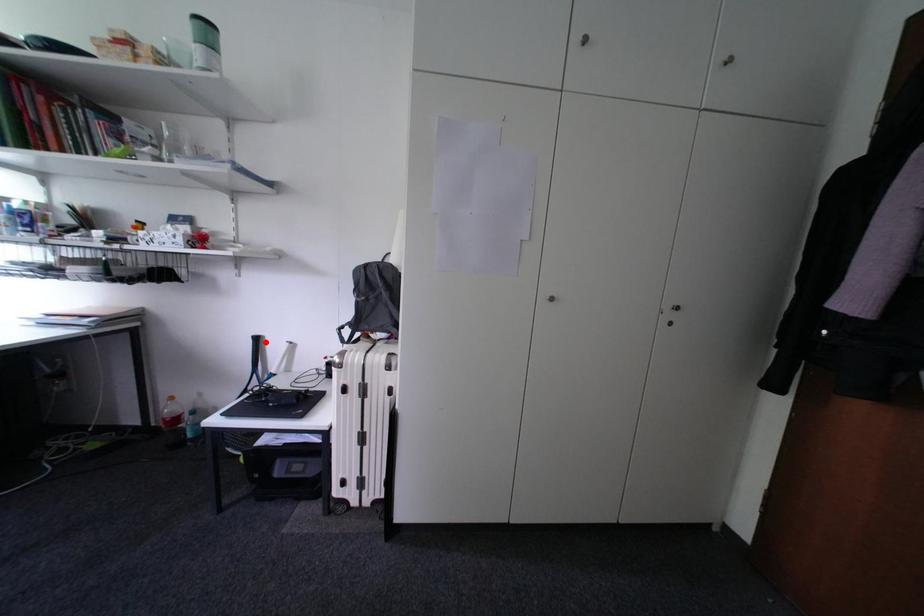
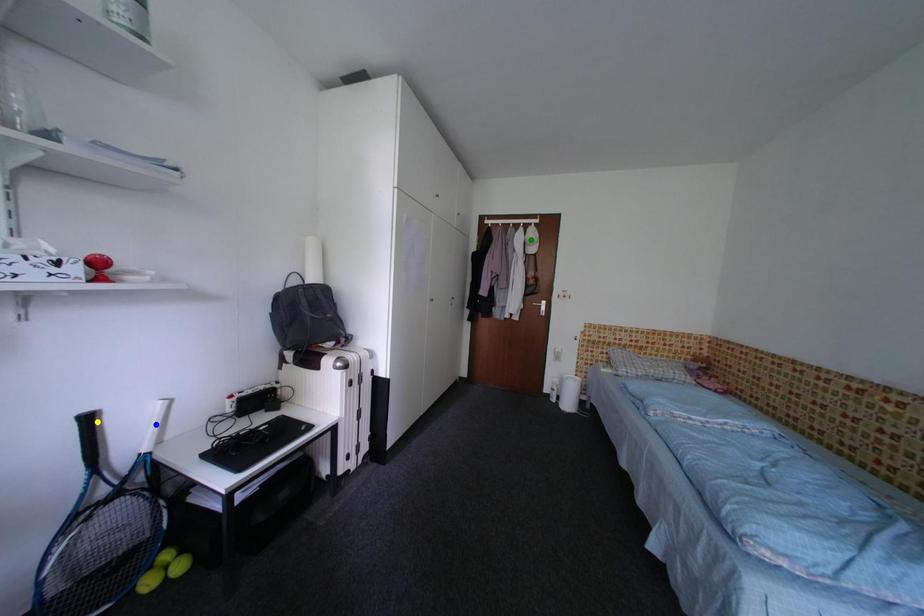
Question: I am providing you with two images of the same scene from different viewpoints. A red point is marked on the first image. You are given multiple points on the second image. Which point in image 2 represents the same 3d spot as the red point in image 1?

Choices:
 (A) yellow point
 (B) blue point
 (C) green point

Answer: (A)